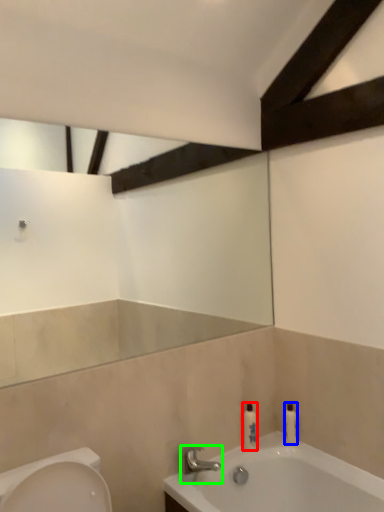
Question: Estimate the real-world distances between objects in this image. Which object is farther from toiletry (highlighted by a red box), toiletry (highlighted by a blue box) or tap (highlighted by a green box)?

Choices:
 (A) toiletry
 (B) tap

Answer: (B)